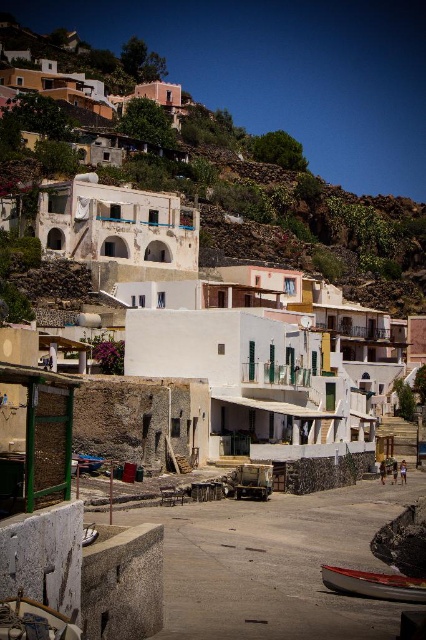
Question: Which object appears closest to the camera in this image?

Choices:
 (A) white wooden boat at lower right
 (B) white stucco houses at upper center

Answer: (A)

Question: Where is white stucco houses at upper center located in relation to white wooden boat at lower right in the image?

Choices:
 (A) right
 (B) left

Answer: (B)

Question: Among these objects, which one is nearest to the camera?

Choices:
 (A) white stucco houses at upper center
 (B) white wooden boat at lower right

Answer: (B)

Question: Can you confirm if white stucco houses at upper center is positioned above white wooden boat at lower right?

Choices:
 (A) no
 (B) yes

Answer: (B)

Question: Which point is closer to the camera taking this photo?

Choices:
 (A) (344, 589)
 (B) (141, 128)

Answer: (A)

Question: Is the position of white stucco houses at upper center less distant than that of white wooden boat at lower right?

Choices:
 (A) yes
 (B) no

Answer: (B)